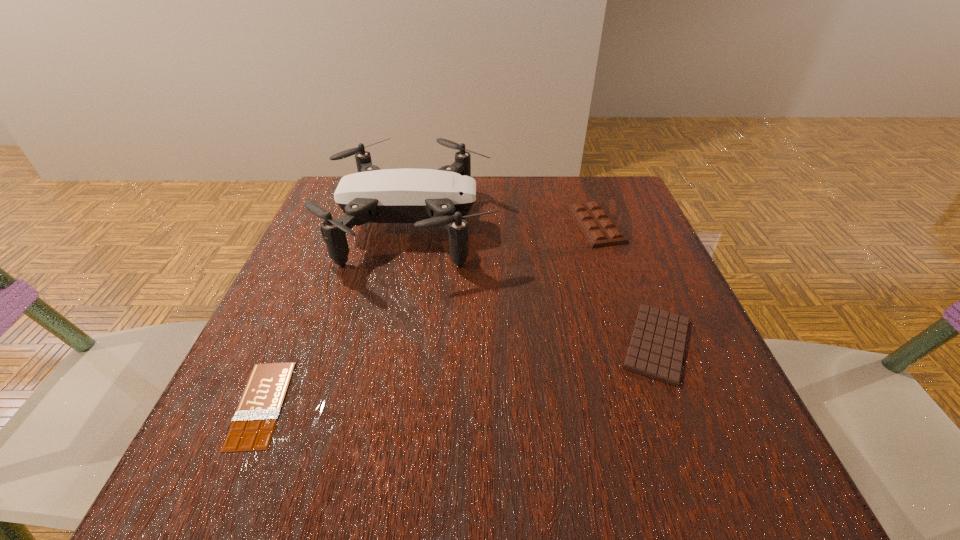
In order to click on drone in this screenshot , I will do `click(429, 198)`.

Where is `the third shortest object`? the third shortest object is located at coordinates (599, 229).

Locate an element on the screen. The height and width of the screenshot is (540, 960). the tallest chocolate bar is located at coordinates (599, 229).

This screenshot has width=960, height=540. I want to click on the second tallest chocolate bar, so click(x=656, y=350).

Where is `the shortest object`? This screenshot has width=960, height=540. the shortest object is located at coordinates (252, 428).

Locate an element on the screen. the leftmost chocolate bar is located at coordinates (252, 428).

What are the coordinates of `blank space located on the camera side of the tallest object` in the screenshot? It's located at [620, 226].

Locate an element on the screen. The image size is (960, 540). blank space located on the front of the tallest chocolate bar is located at coordinates (641, 356).

The width and height of the screenshot is (960, 540). I want to click on blank space located 0.260m on the left of the second tallest chocolate bar, so click(460, 343).

I want to click on vacant region located on the right of the shortest chocolate bar, so click(462, 404).